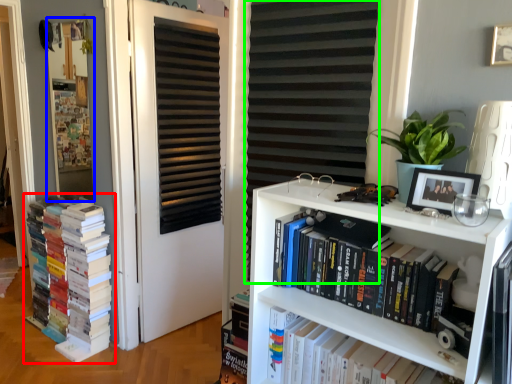
Question: Which object is positioned farthest from book (highlighted by a red box)? Select from bulletin board (highlighted by a blue box) and shutter (highlighted by a green box).

Choices:
 (A) bulletin board
 (B) shutter

Answer: (B)